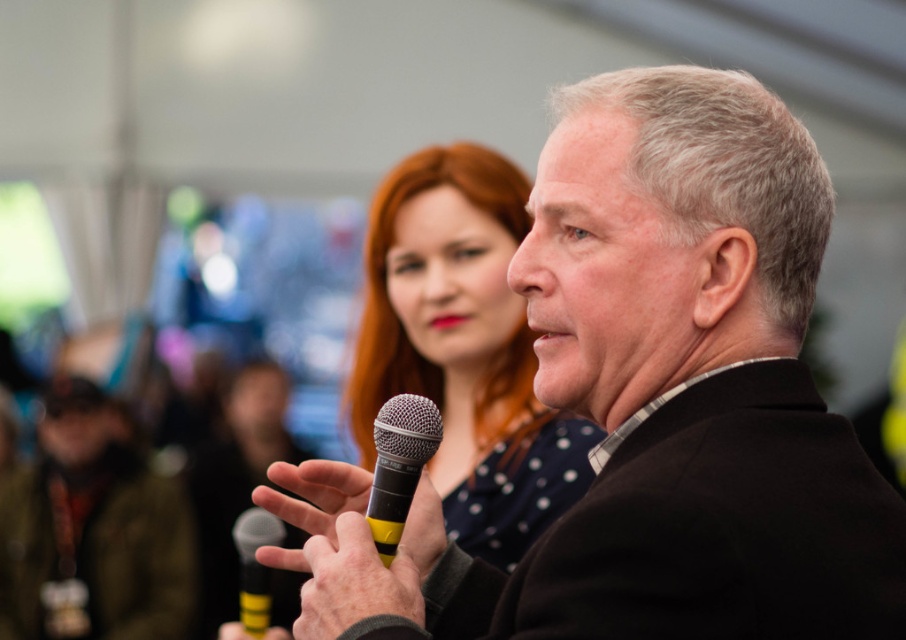
Question: Which point is farther from the camera taking this photo?

Choices:
 (A) (739, 77)
 (B) (378, 515)
 (C) (270, 602)

Answer: (C)

Question: Among these points, which one is nearest to the camera?

Choices:
 (A) (485, 449)
 (B) (426, 426)
 (C) (243, 538)

Answer: (B)

Question: Which point is closer to the camera?

Choices:
 (A) (602, 545)
 (B) (254, 577)
 (C) (400, 508)
 (D) (374, 458)

Answer: (A)

Question: From the image, what is the correct spatial relationship of polka dot fabric dress at center in relation to silver metallic microphone at center?

Choices:
 (A) above
 (B) below

Answer: (A)

Question: Can you confirm if black matte suit at center is positioned to the left of polka dot fabric dress at center?

Choices:
 (A) no
 (B) yes

Answer: (A)

Question: Is black matte suit at center bigger than black matte microphone at center?

Choices:
 (A) no
 (B) yes

Answer: (B)